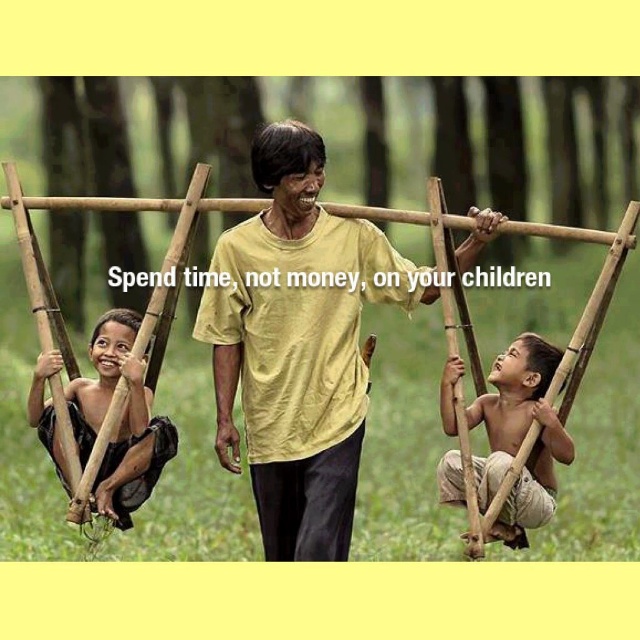
Question: Which object appears closest to the camera in this image?

Choices:
 (A) black fabric child at left
 (B) yellow cotton shirt at center

Answer: (B)

Question: Which point is closer to the camera?

Choices:
 (A) brown skin child at center
 (B) black fabric child at left
 (C) yellow cotton shirt at center

Answer: (C)

Question: Is yellow cotton shirt at center further to camera compared to brown skin child at center?

Choices:
 (A) no
 (B) yes

Answer: (A)

Question: Can you confirm if brown skin child at center is positioned to the right of black fabric child at left?

Choices:
 (A) no
 (B) yes

Answer: (B)

Question: Which is farther from the yellow cotton shirt at center?

Choices:
 (A) black fabric child at left
 (B) brown skin child at center

Answer: (B)

Question: Is yellow cotton shirt at center in front of brown skin child at center?

Choices:
 (A) no
 (B) yes

Answer: (B)